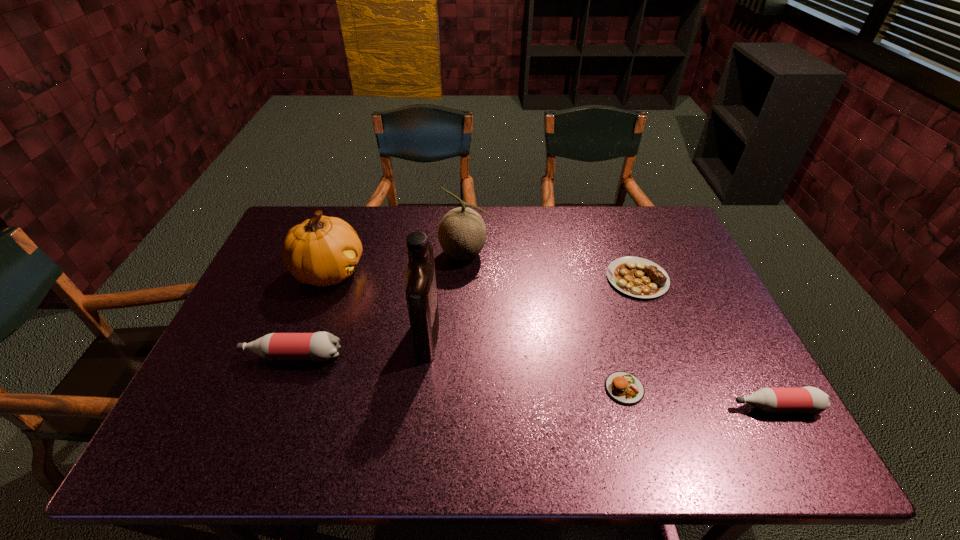
Where is `bottle situated at the near edge`? This screenshot has height=540, width=960. bottle situated at the near edge is located at coordinates (808, 399).

Identify the location of patty that is at the near edge. The image size is (960, 540). (623, 387).

The image size is (960, 540). Identify the location of bottle that is at the left edge. (321, 346).

This screenshot has width=960, height=540. I want to click on pumpkin at the left edge, so click(x=322, y=251).

At what (x,y) coordinates should I click in order to perform the action: click on bottle located in the right edge section of the desktop. Please return your answer as a coordinate pair (x, y). The height and width of the screenshot is (540, 960). Looking at the image, I should click on (808, 399).

You are a GUI agent. You are given a task and a screenshot of the screen. Output one action in this format:
    pyautogui.click(x=<x>, y=<y>)
    Task: Click on the steak that is at the right edge
    The width and height of the screenshot is (960, 540).
    Given the screenshot: What is the action you would take?
    pyautogui.click(x=637, y=277)

This screenshot has height=540, width=960. What are the coordinates of `object present at the far left corner` in the screenshot? It's located at (322, 251).

Find the location of a particular element. This screenshot has width=960, height=540. object located at the near right corner is located at coordinates (808, 399).

In order to click on free space at the far edge of the desktop in this screenshot , I will do `click(360, 239)`.

Identify the location of blank space at the left edge of the desktop. Image resolution: width=960 pixels, height=540 pixels. (234, 349).